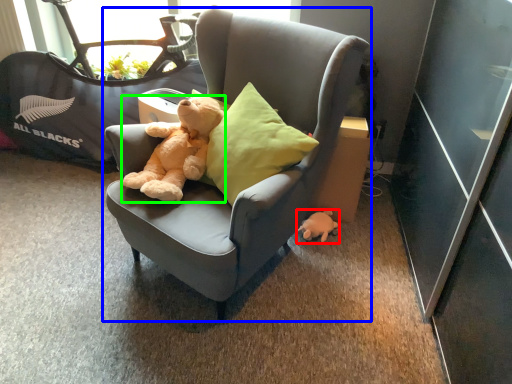
Question: Considering the real-world distances, which object is farthest from toy (highlighted by a red box)? chair (highlighted by a blue box) or teddy bear (highlighted by a green box)?

Choices:
 (A) chair
 (B) teddy bear

Answer: (B)